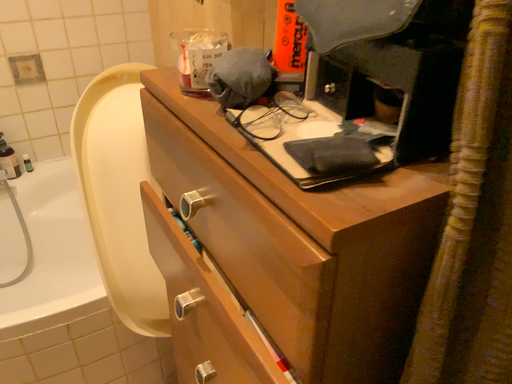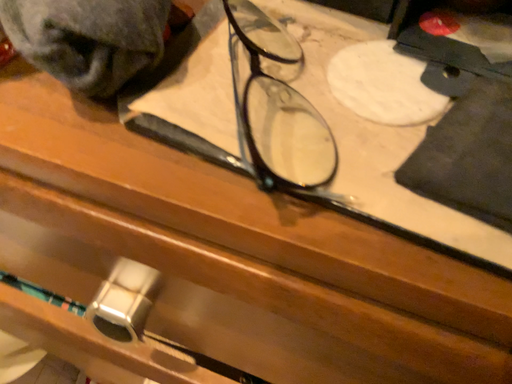
Question: How did the camera likely rotate when shooting the video?

Choices:
 (A) rotated downward
 (B) rotated upward

Answer: (A)